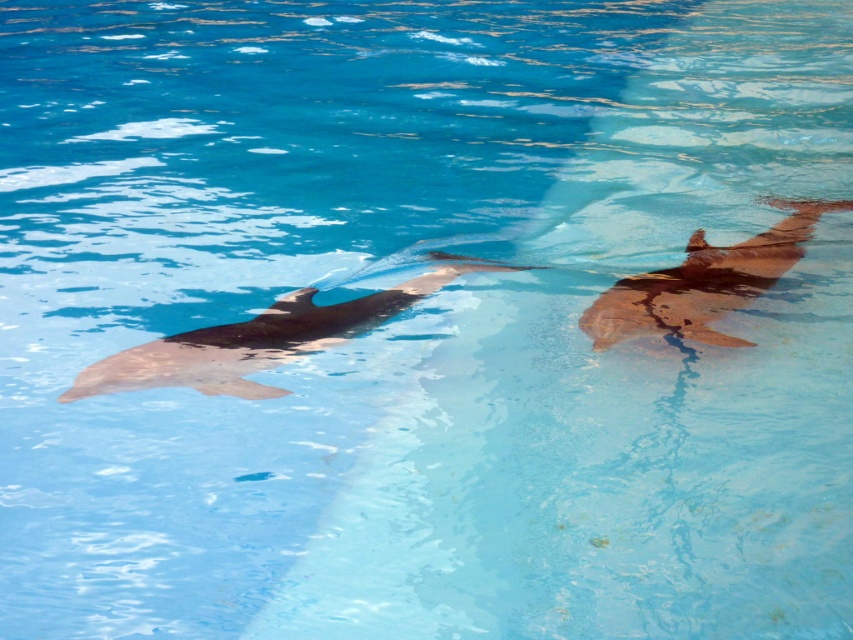
Question: Does smooth gray dolphin at center appear over smooth brown dolphin at right?

Choices:
 (A) yes
 (B) no

Answer: (B)

Question: Which of the following is the farthest from the observer?

Choices:
 (A) (286, 333)
 (B) (598, 310)

Answer: (B)

Question: Which point is farther to the camera?

Choices:
 (A) smooth gray dolphin at center
 (B) smooth brown dolphin at right

Answer: (B)

Question: Is smooth gray dolphin at center positioned in front of smooth brown dolphin at right?

Choices:
 (A) yes
 (B) no

Answer: (A)

Question: Which object appears closest to the camera in this image?

Choices:
 (A) smooth brown dolphin at right
 (B) smooth gray dolphin at center

Answer: (B)

Question: Is the position of smooth gray dolphin at center less distant than that of smooth brown dolphin at right?

Choices:
 (A) yes
 (B) no

Answer: (A)